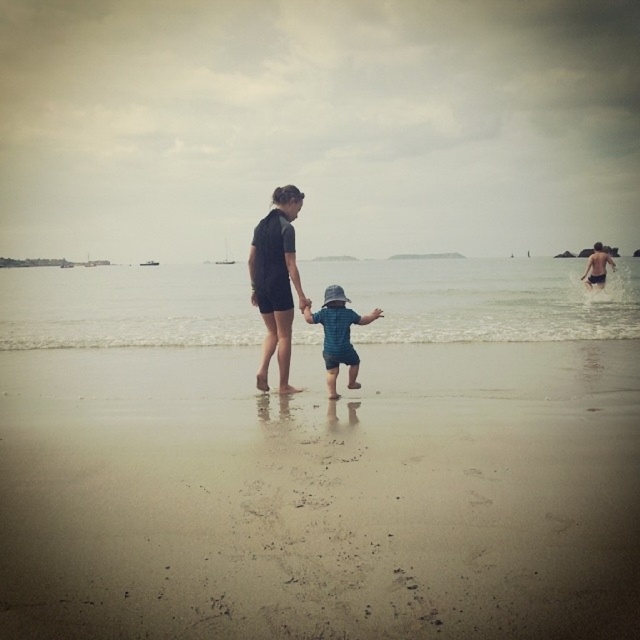
Is point (268, 296) farther from camera compared to point (342, 355)?

Yes, point (268, 296) is behind point (342, 355).

Is matte black wetsuit at center closer to the viewer compared to blue denim shorts at center?

That is True.

Is point (268, 301) closer to viewer compared to point (356, 371)?

Yes, point (268, 301) is in front of point (356, 371).

Locate an element on the screen. The height and width of the screenshot is (640, 640). matte black wetsuit at center is located at coordinates (275, 282).

From the picture: Can you confirm if clear water at center is shorter than blue denim shorts at center?

No, clear water at center is not shorter than blue denim shorts at center.

Is clear water at center to the right of blue denim shorts at center from the viewer's perspective?

Indeed, clear water at center is positioned on the right side of blue denim shorts at center.

What do you see at coordinates (483, 300) in the screenshot?
I see `clear water at center` at bounding box center [483, 300].

Where is `clear water at center`? This screenshot has height=640, width=640. clear water at center is located at coordinates (483, 300).

Does clear water at center have a lesser height compared to matte black wetsuit at center?

No.

Between clear water at center and matte black wetsuit at center, which one has less height?

Standing shorter between the two is matte black wetsuit at center.

Does point (621, 289) lie in front of point (262, 264)?

No, it is behind (262, 264).

The height and width of the screenshot is (640, 640). I want to click on clear water at center, so click(x=483, y=300).